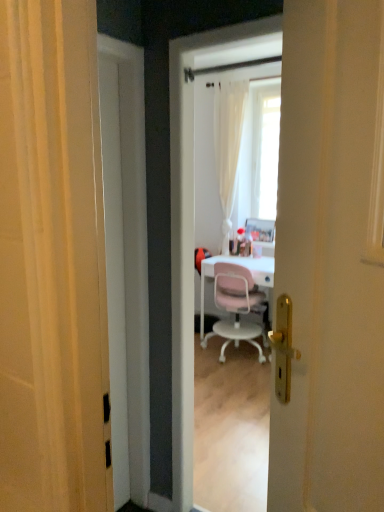
Question: Considering the relative sizes of white glossy screen door at center and pink plastic chair at center in the image provided, is white glossy screen door at center wider than pink plastic chair at center?

Choices:
 (A) yes
 (B) no

Answer: (B)

Question: Is white glossy screen door at center outside pink plastic chair at center?

Choices:
 (A) no
 (B) yes

Answer: (B)

Question: Is white glossy screen door at center smaller than pink plastic chair at center?

Choices:
 (A) no
 (B) yes

Answer: (B)

Question: From a real-world perspective, is white glossy screen door at center beneath pink plastic chair at center?

Choices:
 (A) no
 (B) yes

Answer: (A)

Question: Considering the relative positions of white glossy screen door at center and pink plastic chair at center in the image provided, is white glossy screen door at center in front of pink plastic chair at center?

Choices:
 (A) no
 (B) yes

Answer: (B)

Question: Is white glossy screen door at center turned away from pink plastic chair at center?

Choices:
 (A) no
 (B) yes

Answer: (A)

Question: Can you confirm if white glossy door at center is taller than pink plastic chair at center?

Choices:
 (A) yes
 (B) no

Answer: (A)

Question: Does white glossy door at center appear on the right side of pink plastic chair at center?

Choices:
 (A) yes
 (B) no

Answer: (B)

Question: Are white glossy door at center and pink plastic chair at center far apart?

Choices:
 (A) no
 (B) yes

Answer: (B)

Question: Is white glossy door at center shorter than pink plastic chair at center?

Choices:
 (A) yes
 (B) no

Answer: (B)

Question: From the image's perspective, is white glossy door at center below pink plastic chair at center?

Choices:
 (A) yes
 (B) no

Answer: (B)

Question: Could you tell me if white glossy door at center is turned towards pink plastic chair at center?

Choices:
 (A) no
 (B) yes

Answer: (A)

Question: From a real-world perspective, does white glossy door at center stand above white glossy screen door at center?

Choices:
 (A) no
 (B) yes

Answer: (A)